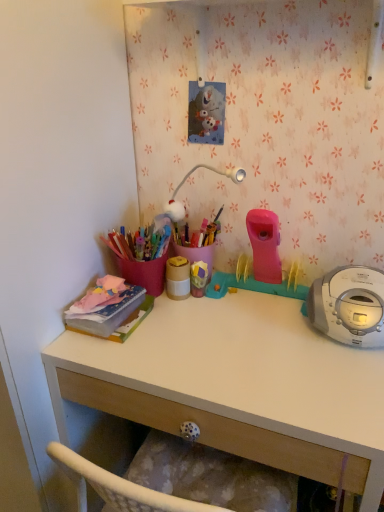
Question: Visually, is matte gold container at center, which is the 1th office supplies from right to left, positioned to the left or to the right of white matte desk at center?

Choices:
 (A) right
 (B) left

Answer: (B)

Question: Which is correct: matte gold container at center, the 2th office supplies when ordered from left to right, is inside white matte desk at center, or outside of it?

Choices:
 (A) inside
 (B) outside

Answer: (B)

Question: Estimate the real-world distances between objects in this image. Which object is farther from the matte pink notebook at left, marked as the 1th office supplies in a left-to-right arrangement?

Choices:
 (A) matte gold container at center, which is the 1th office supplies from right to left
 (B) white matte desk at center

Answer: (B)

Question: Considering the real-world distances, which object is farthest from the white matte desk at center?

Choices:
 (A) matte gold container at center, which is the 1th office supplies from right to left
 (B) matte pink notebook at left, marked as the 1th office supplies in a left-to-right arrangement

Answer: (A)